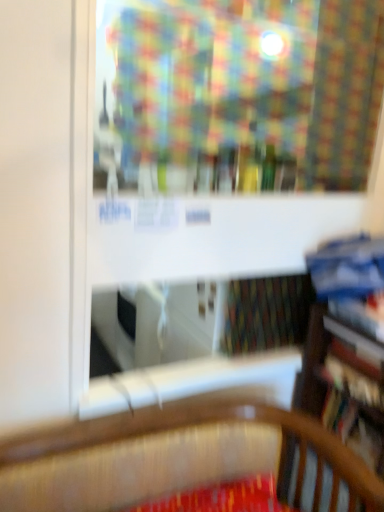
Question: Is blue hardcover book at right, which is counted as the 4th book, starting from the bottom, to the right of hardcover book at right, the 2th book from the bottom, from the viewer's perspective?

Choices:
 (A) yes
 (B) no

Answer: (A)

Question: Is blue hardcover book at right, which is counted as the 4th book, starting from the bottom, bigger than hardcover book at right, the 2th book from the bottom?

Choices:
 (A) no
 (B) yes

Answer: (B)

Question: Considering the relative sizes of blue hardcover book at right, which is counted as the 4th book, starting from the bottom, and hardcover book at right, marked as the third book in a top-to-bottom arrangement, in the image provided, is blue hardcover book at right, which is counted as the 4th book, starting from the bottom, shorter than hardcover book at right, marked as the third book in a top-to-bottom arrangement,?

Choices:
 (A) yes
 (B) no

Answer: (B)

Question: Is hardcover book at right, the 2th book from the bottom, located within blue hardcover book at right, which is counted as the 4th book, starting from the bottom?

Choices:
 (A) yes
 (B) no

Answer: (B)

Question: Considering the relative sizes of blue hardcover book at right, the 1th book from the top, and hardcover book at right, the 2th book from the bottom, in the image provided, is blue hardcover book at right, the 1th book from the top, wider than hardcover book at right, the 2th book from the bottom,?

Choices:
 (A) no
 (B) yes

Answer: (B)

Question: Can you see blue hardcover book at right, the 1th book from the top, touching hardcover book at right, the 2th book from the bottom?

Choices:
 (A) yes
 (B) no

Answer: (B)

Question: Is hardcover book at right, marked as the first book in a bottom-to-top arrangement, aimed at blue hardcover book at right, which is counted as the 4th book, starting from the bottom?

Choices:
 (A) yes
 (B) no

Answer: (B)

Question: Does hardcover book at right, which is counted as the 4th book, starting from the top, have a greater width compared to blue hardcover book at right, the 1th book from the top?

Choices:
 (A) no
 (B) yes

Answer: (A)

Question: From the image's perspective, does hardcover book at right, which is counted as the 4th book, starting from the top, appear higher than blue hardcover book at right, which is counted as the 4th book, starting from the bottom?

Choices:
 (A) yes
 (B) no

Answer: (B)

Question: Does hardcover book at right, which is counted as the 4th book, starting from the top, lie behind blue hardcover book at right, which is counted as the 4th book, starting from the bottom?

Choices:
 (A) no
 (B) yes

Answer: (B)

Question: Considering the relative sizes of hardcover book at right, which is counted as the 4th book, starting from the top, and blue hardcover book at right, the 1th book from the top, in the image provided, is hardcover book at right, which is counted as the 4th book, starting from the top, shorter than blue hardcover book at right, the 1th book from the top,?

Choices:
 (A) yes
 (B) no

Answer: (A)

Question: From the image's perspective, would you say hardcover book at right, marked as the first book in a bottom-to-top arrangement, is shown under blue hardcover book at right, which is counted as the 4th book, starting from the bottom?

Choices:
 (A) no
 (B) yes

Answer: (B)

Question: Is hardcover book at right, marked as the third book in a top-to-bottom arrangement, beside hardcover book at right, which is counted as the 4th book, starting from the top?

Choices:
 (A) no
 (B) yes

Answer: (A)